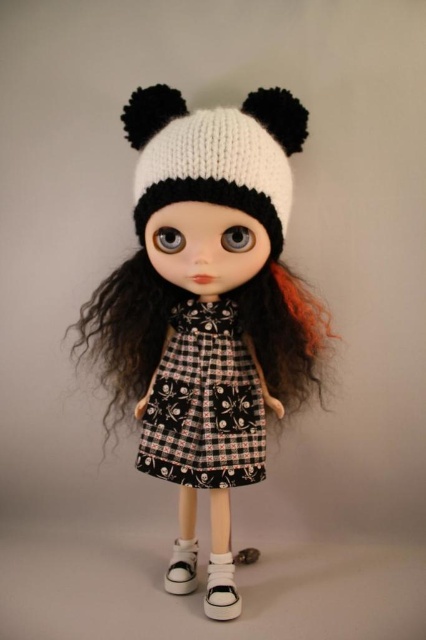
Question: Which object appears farthest from the camera in this image?

Choices:
 (A) curly hair at center
 (B) white canvas shoe at lower center

Answer: (A)

Question: Among these objects, which one is farthest from the camera?

Choices:
 (A) white matte shoe at lower center
 (B) white canvas shoe at lower center

Answer: (B)

Question: Which point is closer to the camera?

Choices:
 (A) white knitted hat at center
 (B) white knitted hat at upper center

Answer: (B)

Question: Observing the image, what is the correct spatial positioning of white matte shoe at lower center in reference to white canvas shoe at lower center?

Choices:
 (A) right
 (B) left

Answer: (A)

Question: Can you confirm if white knitted hat at center is positioned above white knitted hat at upper center?

Choices:
 (A) no
 (B) yes

Answer: (A)

Question: Where is curly hair at center located in relation to white knitted hat at upper center in the image?

Choices:
 (A) below
 (B) above

Answer: (A)